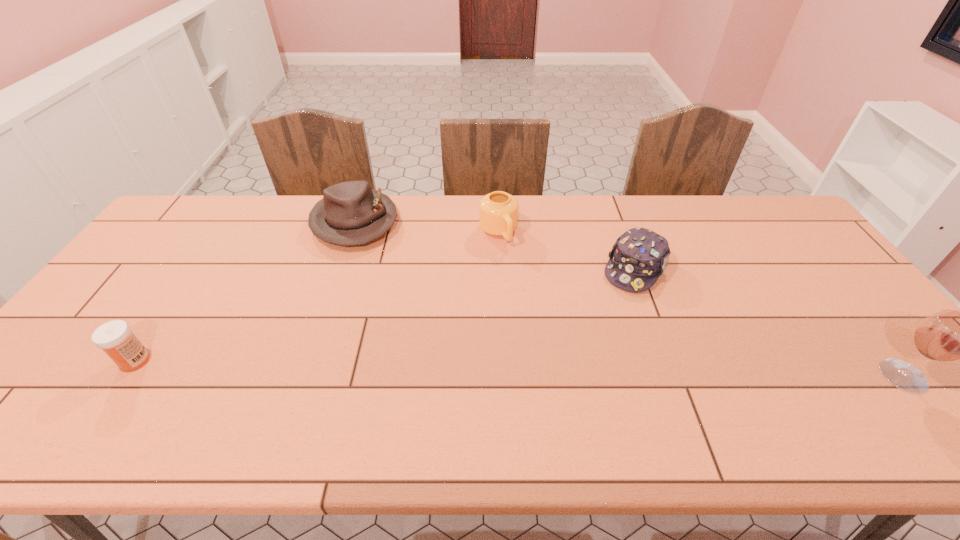
This screenshot has width=960, height=540. What are the coordinates of `free location located on the handle side of the third object from left to right` in the screenshot? It's located at (554, 330).

I want to click on free space located on the decorative side of the fourth object from right to left, so point(381,305).

Find the location of `free space located 0.180m on the decorative side of the fourth object from right to left`. free space located 0.180m on the decorative side of the fourth object from right to left is located at coordinates (376, 290).

This screenshot has height=540, width=960. I want to click on free location located on the decorative side of the fourth object from right to left, so coord(395,345).

I want to click on vacant point located 0.160m on the front-facing side of the headwear, so click(x=599, y=326).

At what (x,y) coordinates should I click in order to perform the action: click on vacant space situated on the front-facing side of the headwear. Please return your answer as a coordinate pair (x, y). The image size is (960, 540). Looking at the image, I should click on (559, 389).

The width and height of the screenshot is (960, 540). Find the location of `vacant area located on the front-facing side of the headwear`. vacant area located on the front-facing side of the headwear is located at coordinates (601, 323).

Locate an element on the screen. mug situated at the far edge is located at coordinates (498, 211).

Locate an element on the screen. This screenshot has height=540, width=960. hat present at the far edge is located at coordinates [351, 213].

Identify the location of medicine that is at the near edge. This screenshot has width=960, height=540. (115, 338).